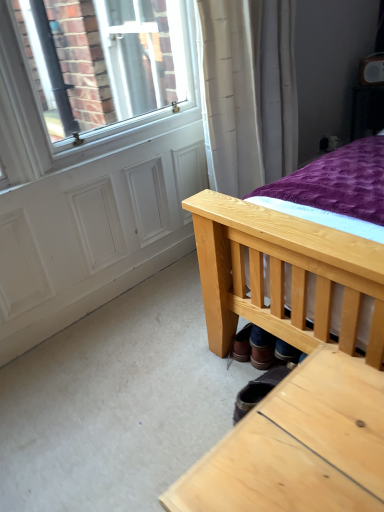
Question: From a real-world perspective, is leather boot at lower center located beneath white matte screen door at lower left?

Choices:
 (A) yes
 (B) no

Answer: (A)

Question: Is leather boot at lower center positioned beyond the bounds of white matte screen door at lower left?

Choices:
 (A) no
 (B) yes

Answer: (B)

Question: Can you confirm if leather boot at lower center is bigger than white matte screen door at lower left?

Choices:
 (A) no
 (B) yes

Answer: (A)

Question: Is leather boot at lower center directly adjacent to white matte screen door at lower left?

Choices:
 (A) no
 (B) yes

Answer: (A)

Question: From the image's perspective, is leather boot at lower center on top of white matte screen door at lower left?

Choices:
 (A) yes
 (B) no

Answer: (B)

Question: Considering the relative sizes of leather boot at lower center and white matte screen door at lower left in the image provided, is leather boot at lower center taller than white matte screen door at lower left?

Choices:
 (A) no
 (B) yes

Answer: (A)

Question: Is white matte screen door at lower left positioned far away from brown leather shoe at lower center?

Choices:
 (A) yes
 (B) no

Answer: (B)

Question: From a real-world perspective, does white matte screen door at lower left stand above brown leather shoe at lower center?

Choices:
 (A) yes
 (B) no

Answer: (A)

Question: Is brown leather shoe at lower center at the back of white matte screen door at lower left?

Choices:
 (A) yes
 (B) no

Answer: (B)

Question: Considering the relative positions of white matte screen door at lower left and brown leather shoe at lower center in the image provided, is white matte screen door at lower left to the right of brown leather shoe at lower center from the viewer's perspective?

Choices:
 (A) no
 (B) yes

Answer: (A)

Question: Can you confirm if white matte screen door at lower left is taller than brown leather shoe at lower center?

Choices:
 (A) no
 (B) yes

Answer: (A)

Question: Does white matte screen door at lower left appear on the left side of brown leather shoe at lower center?

Choices:
 (A) yes
 (B) no

Answer: (A)

Question: Is brown leather shoe at lower center oriented away from leather boot at lower center?

Choices:
 (A) no
 (B) yes

Answer: (A)